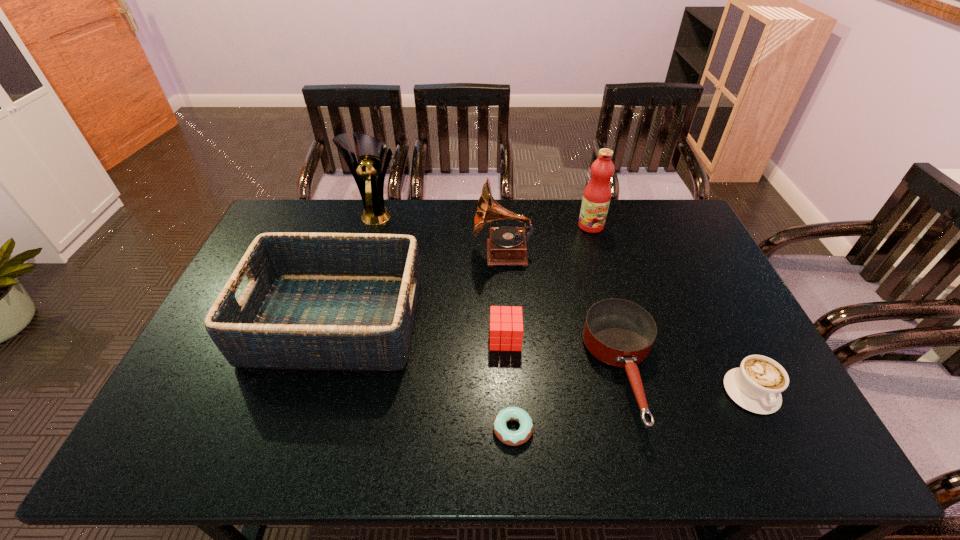
The image size is (960, 540). Find the location of `vacant space in between the shortest object and the fruit juice`. vacant space in between the shortest object and the fruit juice is located at coordinates (552, 327).

The height and width of the screenshot is (540, 960). I want to click on free space between the basket and the fruit juice, so click(463, 273).

Locate an element on the screen. empty location between the fruit juice and the phonograph_record is located at coordinates (x=546, y=239).

Identify the location of free point between the cube and the phonograph_record. The width and height of the screenshot is (960, 540). click(x=504, y=296).

I want to click on empty location between the phonograph_record and the pan, so click(x=563, y=312).

This screenshot has height=540, width=960. What are the coordinates of `vacant area that lies between the cube and the award` in the screenshot? It's located at (441, 276).

You are a GUI agent. You are given a task and a screenshot of the screen. Output one action in this format:
    pyautogui.click(x=<x>, y=<y>)
    Task: Click on the free space that is in between the phonograph_record and the pan
    The image size is (960, 540).
    Given the screenshot: What is the action you would take?
    pyautogui.click(x=563, y=312)

I want to click on free spot between the pan and the cube, so click(x=564, y=355).

Choose which object is the nearest neighbor to the third farthest object. Please provide its 2D coordinates. Your answer should be formatted as a tuple, i.e. [(x, y)], where the tuple contains the x and y coordinates of a point satisfying the conditions above.

[(314, 301)]

Locate which object ranks third in proximity to the shortest object. Please provide its 2D coordinates. Your answer should be formatted as a tuple, i.e. [(x, y)], where the tuple contains the x and y coordinates of a point satisfying the conditions above.

[(314, 301)]